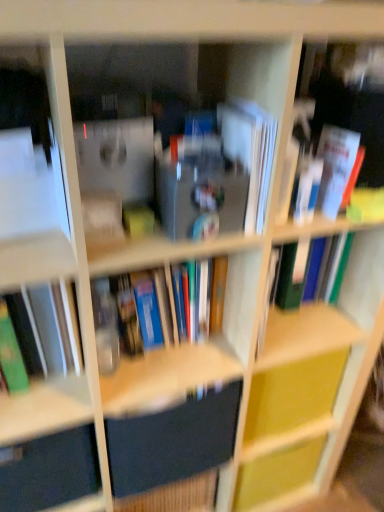
Question: From a real-world perspective, relative to green matte book at left, which ranks as the 4th book in right-to-left order, is white paper book at right, which appears as the 2th book when viewed from the right, vertically above or below?

Choices:
 (A) below
 (B) above

Answer: (B)

Question: Choose the correct answer: Is white paper book at right, which appears as the 2th book when viewed from the right, inside green matte book at left, which ranks as the 4th book in right-to-left order, or outside it?

Choices:
 (A) inside
 (B) outside

Answer: (B)

Question: Which object is positioned closest to the matte black drawer at lower left?

Choices:
 (A) yellow matte cabinet at center
 (B) white paper book at right, marked as the third book in a left-to-right arrangement
 (C) dark blue matte book at center, positioned as the second paperback book in top-to-bottom order
 (D) white paper at center, arranged as the 2th paperback book when ordered from the bottom
 (E) white paper book at upper right, the 1th book in the right-to-left sequence

Answer: (C)

Question: Which object is the closest to the hardcover book at center, the second book in the left-to-right sequence?

Choices:
 (A) green matte book at left, which ranks as the 4th book in right-to-left order
 (B) matte black drawer at lower left
 (C) white paper at center, arranged as the 2th paperback book when ordered from the bottom
 (D) yellow matte cabinet at center
 (E) white paper book at right, which appears as the 2th book when viewed from the right

Answer: (A)